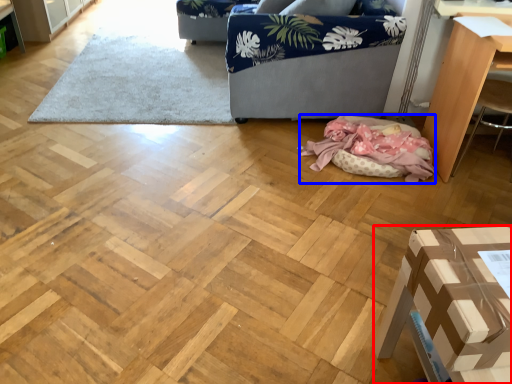
Question: Which object is further to the camera taking this photo, furniture (highlighted by a red box) or blanket (highlighted by a blue box)?

Choices:
 (A) furniture
 (B) blanket

Answer: (B)